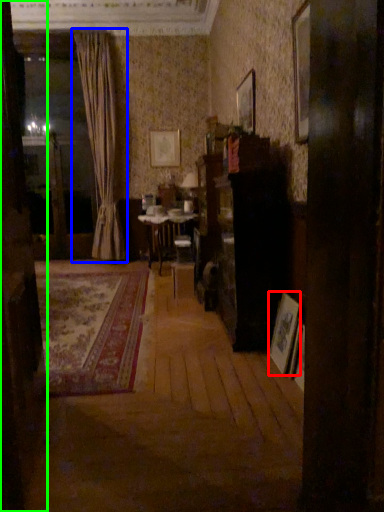
Question: Considering the real-world distances, which object is closest to picture frame (highlighted by a red box)? curtain (highlighted by a blue box) or door (highlighted by a green box).

Choices:
 (A) curtain
 (B) door

Answer: (B)